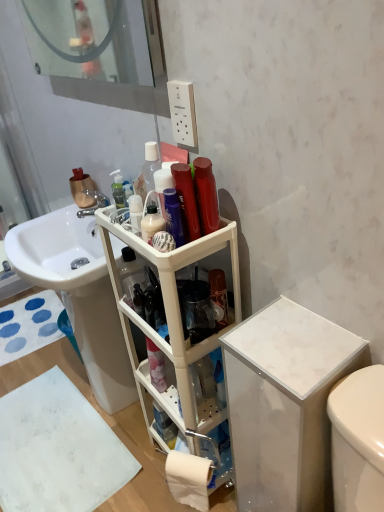
Question: In the image, is white fabric bath mat at lower left, the 1th bath mat viewed from the top, on the left side or the right side of metallic silver faucet at sink left?

Choices:
 (A) right
 (B) left

Answer: (B)

Question: From a real-world perspective, relative to metallic silver faucet at sink left, is white fabric bath mat at lower left, which is the 2th bath mat in front-to-back order, vertically above or below?

Choices:
 (A) below
 (B) above

Answer: (A)

Question: Considering the real-world distances, which object is closest to the translucent plastic bottle at center, arranged as the first cleaning product when viewed from the left?

Choices:
 (A) white matte toilet paper at lower center
 (B) shiny red bottle at upper center, the 2th cleaning product from the left
 (C) shiny purple bottle at upper center, the third toiletry in the back-to-front sequence
 (D) white matte bath mat at lower left, marked as the 2th bath mat in a top-to-bottom arrangement
 (E) clear glass mirror at upper left

Answer: (C)

Question: Estimate the real-world distances between objects in this image. Which object is farther from the translucent plastic pump bottle at upper center, which is the second toiletry in top-to-bottom order?

Choices:
 (A) white glossy sink at center
 (B) white matte bath mat at lower left, positioned as the 2th bath mat in back-to-front order
 (C) white marble cabinet at right, which ranks as the first cabinetry in right-to-left order
 (D) white plastic shelf at center, the second cabinetry in the right-to-left sequence
 (E) translucent plastic bottle at center, the second cleaning product from the right

Answer: (B)